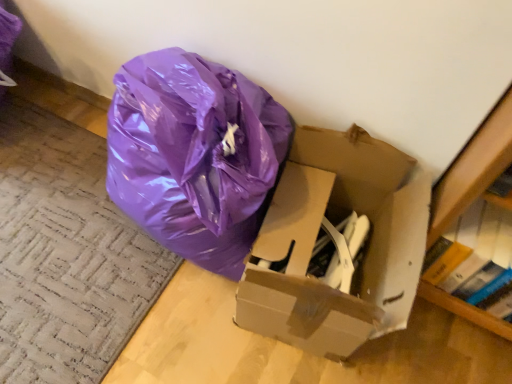
Question: Is cardboard box at center not inside hardcover book at right?

Choices:
 (A) yes
 (B) no

Answer: (A)

Question: Is cardboard box at center closer to the viewer compared to hardcover book at right?

Choices:
 (A) yes
 (B) no

Answer: (A)

Question: Is cardboard box at center not close to hardcover book at right?

Choices:
 (A) no
 (B) yes

Answer: (A)

Question: From a real-world perspective, is cardboard box at center physically below hardcover book at right?

Choices:
 (A) no
 (B) yes

Answer: (B)

Question: From the image's perspective, would you say cardboard box at center is positioned over hardcover book at right?

Choices:
 (A) no
 (B) yes

Answer: (B)

Question: From the image's perspective, is cardboard box at center located beneath hardcover book at right?

Choices:
 (A) yes
 (B) no

Answer: (B)

Question: Can you confirm if hardcover book at right is bigger than cardboard box at center?

Choices:
 (A) yes
 (B) no

Answer: (B)

Question: From a real-world perspective, is hardcover book at right over cardboard box at center?

Choices:
 (A) no
 (B) yes

Answer: (B)

Question: Is hardcover book at right completely or partially outside of cardboard box at center?

Choices:
 (A) yes
 (B) no

Answer: (A)

Question: Is hardcover book at right closer to the viewer compared to cardboard box at center?

Choices:
 (A) no
 (B) yes

Answer: (A)

Question: Does hardcover book at right lie behind cardboard box at center?

Choices:
 (A) no
 (B) yes

Answer: (B)

Question: Can you confirm if hardcover book at right is thinner than cardboard box at center?

Choices:
 (A) no
 (B) yes

Answer: (B)

Question: In the image, is hardcover book at right positioned in front of or behind cardboard box at center?

Choices:
 (A) behind
 (B) front

Answer: (A)